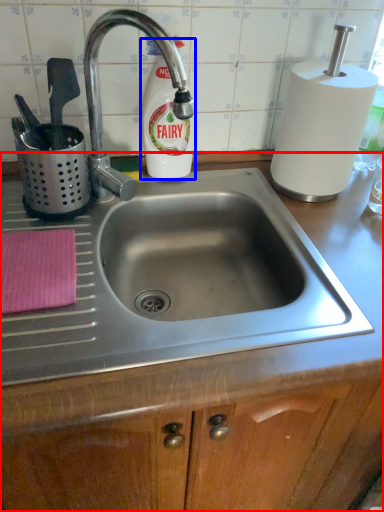
Question: Which object appears closest to the camera in this image, counter (highlighted by a red box) or cleaning product (highlighted by a blue box)?

Choices:
 (A) counter
 (B) cleaning product

Answer: (A)